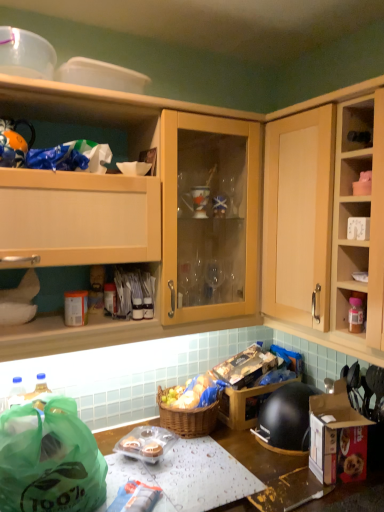
Question: Considering the positions of wooden table at lower center and wooden cabinet at right, arranged as the 2th cabinetry when viewed from the left, in the image, is wooden table at lower center wider or thinner than wooden cabinet at right, arranged as the 2th cabinetry when viewed from the left,?

Choices:
 (A) thin
 (B) wide

Answer: (B)

Question: Relative to wooden cabinet at right, the first cabinetry in the right-to-left sequence, is wooden table at lower center in front or behind?

Choices:
 (A) front
 (B) behind

Answer: (A)

Question: Which of these objects is positioned farthest from the green plastic bag at lower left?

Choices:
 (A) matte wood cabinet at upper left, acting as the first cabinetry starting from the left
 (B) brown woven basket at lower center
 (C) woven brown picnic basket at lower center
 (D) wooden cabinet at right, arranged as the 2th cabinetry when viewed from the left
 (E) matte plastic container at upper right

Answer: (E)

Question: Which object is positioned farthest from the cardboard box with dog food at lower right?

Choices:
 (A) wooden table at lower center
 (B) woven brown picnic basket at lower center
 (C) green plastic bag at lower left
 (D) wooden cabinet at right, arranged as the 2th cabinetry when viewed from the left
 (E) matte wood cabinet at upper left, the 2th cabinetry when ordered from right to left

Answer: (E)